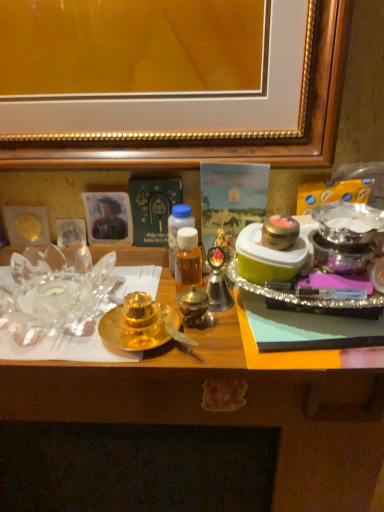
Describe the element at coordinates (232, 411) in the screenshot. I see `gold metallic tray at center` at that location.

Locate an element on the screen. This screenshot has height=512, width=384. gold metallic tray at center is located at coordinates (232, 411).

I want to click on gold metallic tray at center, so click(232, 411).